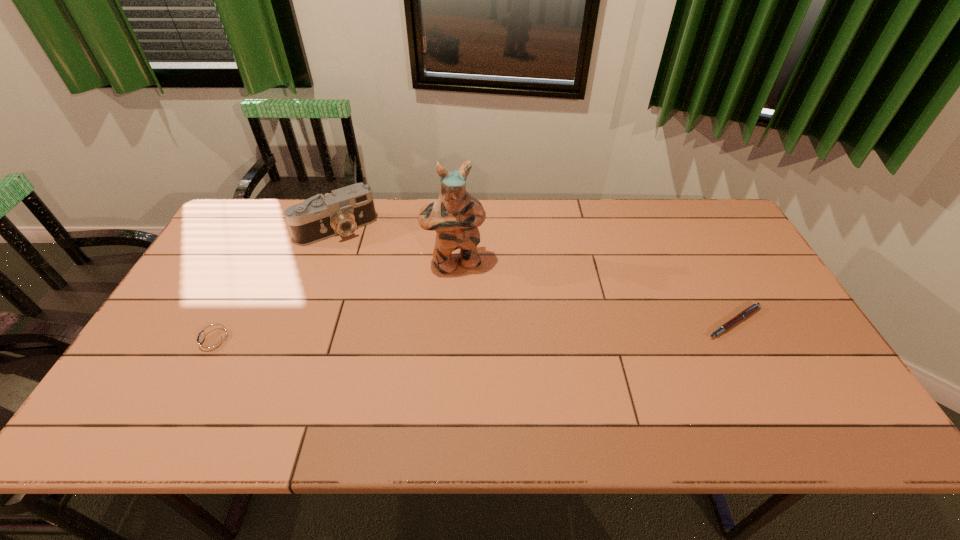
The height and width of the screenshot is (540, 960). Find the location of `unoccupied area between the camera and the rightmost object`. unoccupied area between the camera and the rightmost object is located at coordinates (536, 275).

Locate an element on the screen. Image resolution: width=960 pixels, height=540 pixels. empty space between the second shortest object and the tallest object is located at coordinates (334, 302).

You are a GUI agent. You are given a task and a screenshot of the screen. Output one action in this format:
    pyautogui.click(x=<x>, y=<y>)
    Task: Click on the empty space between the camera and the third nearest object
    The image size is (960, 540).
    Given the screenshot: What is the action you would take?
    pyautogui.click(x=396, y=246)

Find the location of a particular element. This screenshot has height=540, width=960. free spot between the leftmost object and the third shortest object is located at coordinates (275, 285).

This screenshot has width=960, height=540. Find the location of `object that can be found as the third closest to the figurine`. object that can be found as the third closest to the figurine is located at coordinates (754, 307).

Identify which object is the third nearest to the second tallest object. Please provide its 2D coordinates. Your answer should be formatted as a tuple, i.e. [(x, y)], where the tuple contains the x and y coordinates of a point satisfying the conditions above.

[(754, 307)]